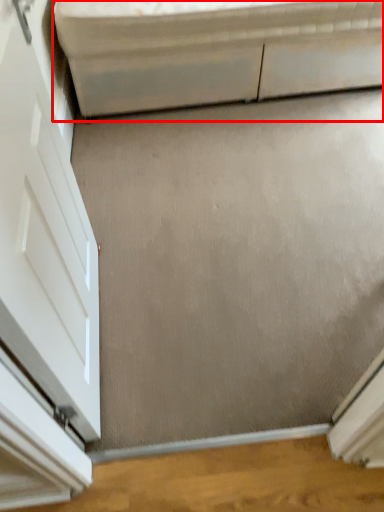
Question: In this image, where is furniture (annotated by the red box) located relative to door?

Choices:
 (A) right
 (B) left

Answer: (A)